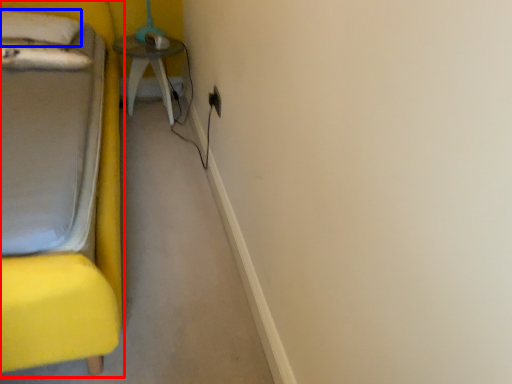
Question: Which object is further to the camera taking this photo, furniture (highlighted by a red box) or pillow (highlighted by a blue box)?

Choices:
 (A) furniture
 (B) pillow

Answer: (B)